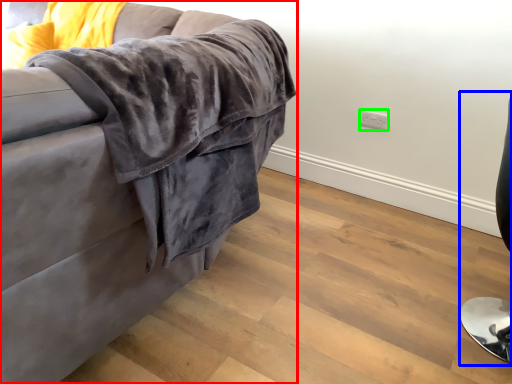
Question: Based on their relative distances, which object is nearer to studio couch (highlighted by a red box)? Choose from computer chair (highlighted by a blue box) and electric outlet (highlighted by a green box).

Choices:
 (A) computer chair
 (B) electric outlet

Answer: (A)